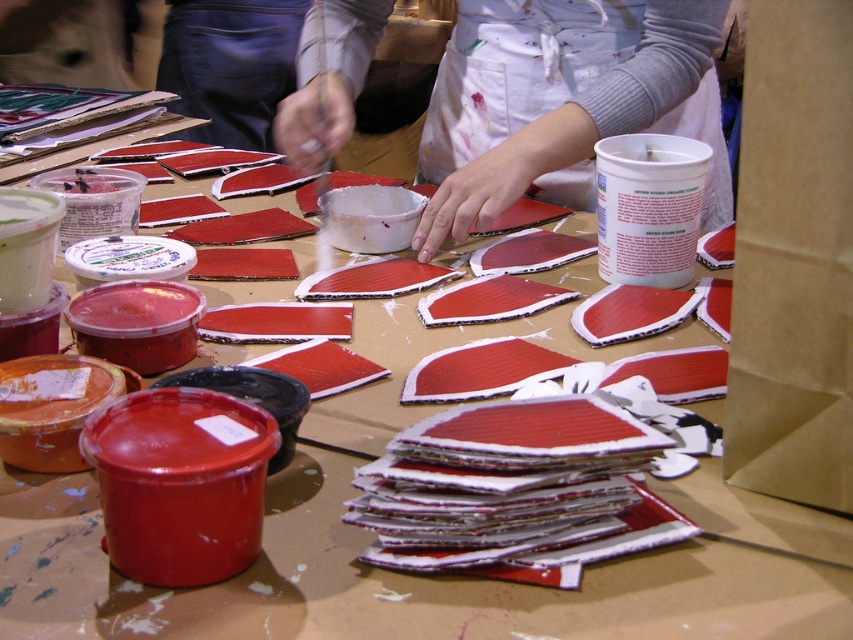
Is brown paper bag at right further to the viewer compared to white apron at center?

No, it is not.

Which is behind, point (782, 390) or point (671, 1)?

Positioned behind is point (671, 1).

Measure the distance between point (798, 250) and camera.

23.85 inches

This screenshot has width=853, height=640. I want to click on brown paper bag at right, so click(793, 259).